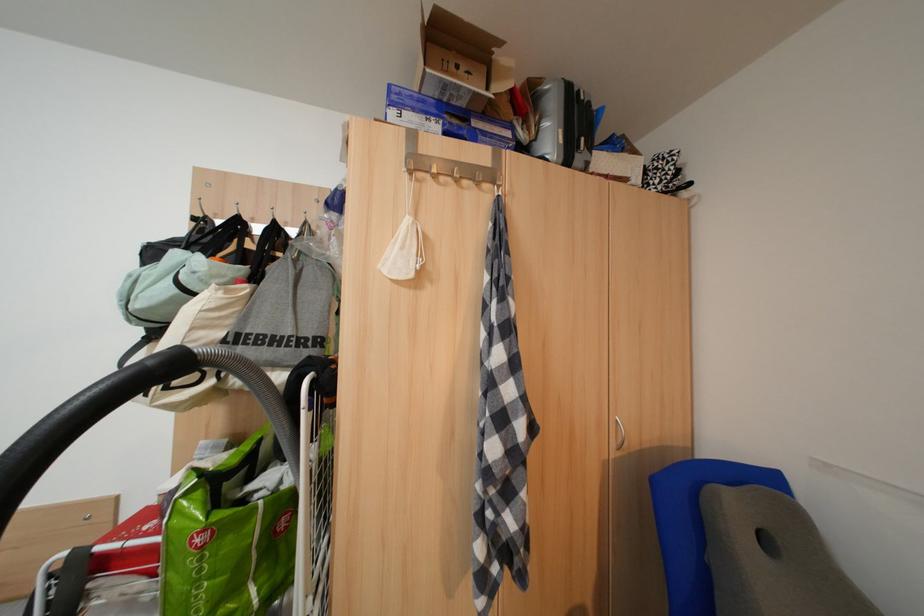
Which object does [554,121] point to?

It corresponds to the small silver suitcase in the image.